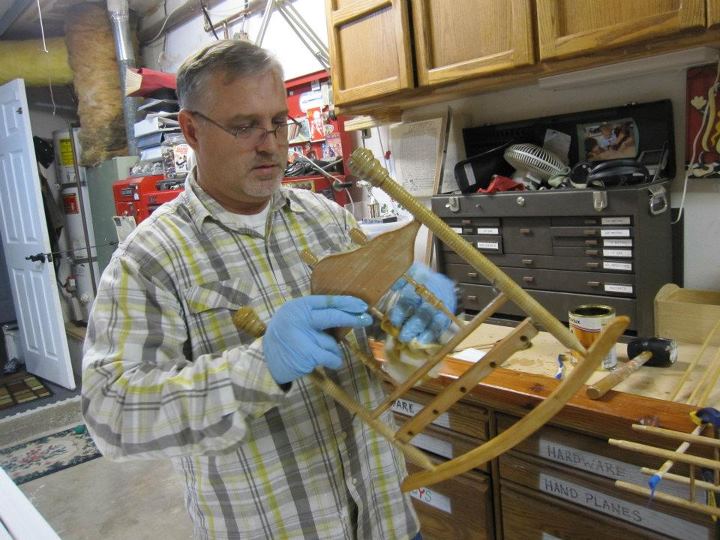
At what (x,y) coordinates should I click in order to perform the action: click on tags of the cabinet drawers. Please return your answer as a coordinate pair (x, y). The image size is (720, 540). Looking at the image, I should click on (595, 451), (626, 510), (410, 402), (448, 444), (445, 507).